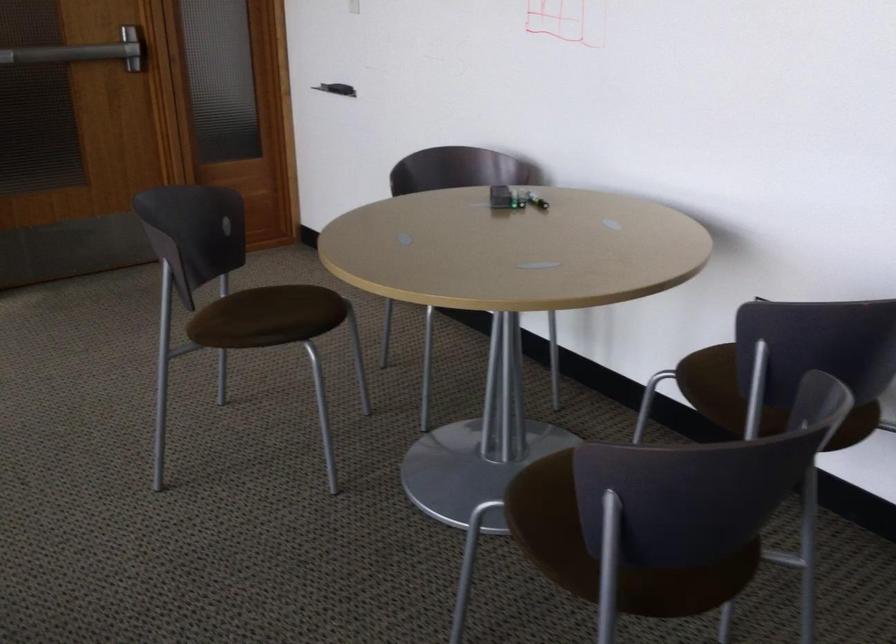
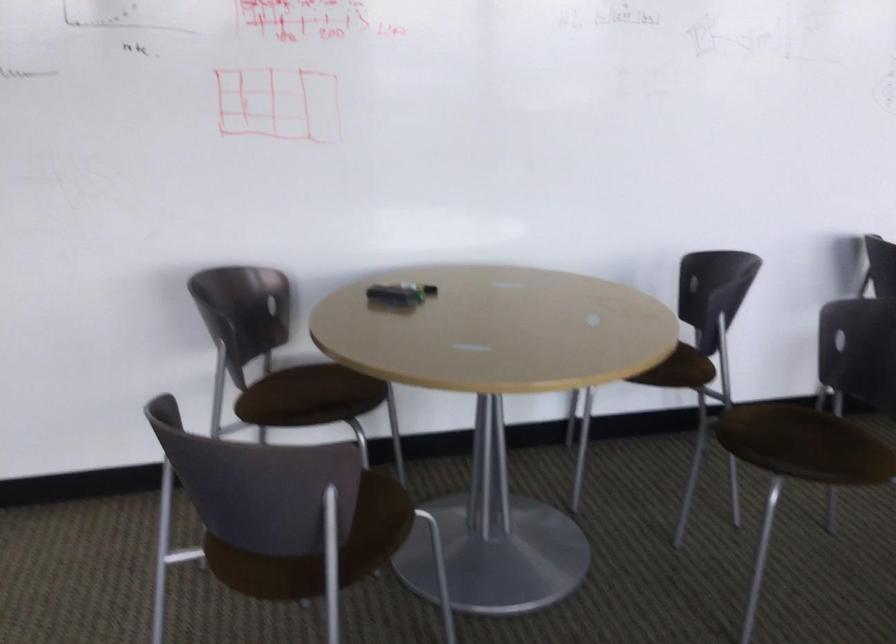
The point at (219, 321) is marked in the first image. Where is the corresponding point in the second image?

(261, 570)